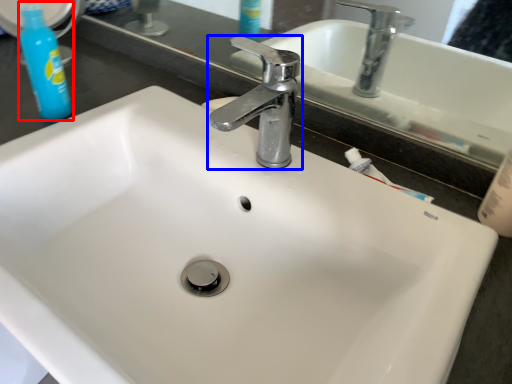
Question: Among these objects, which one is farthest to the camera, cleaning product (highlighted by a red box) or tap (highlighted by a blue box)?

Choices:
 (A) cleaning product
 (B) tap

Answer: (A)